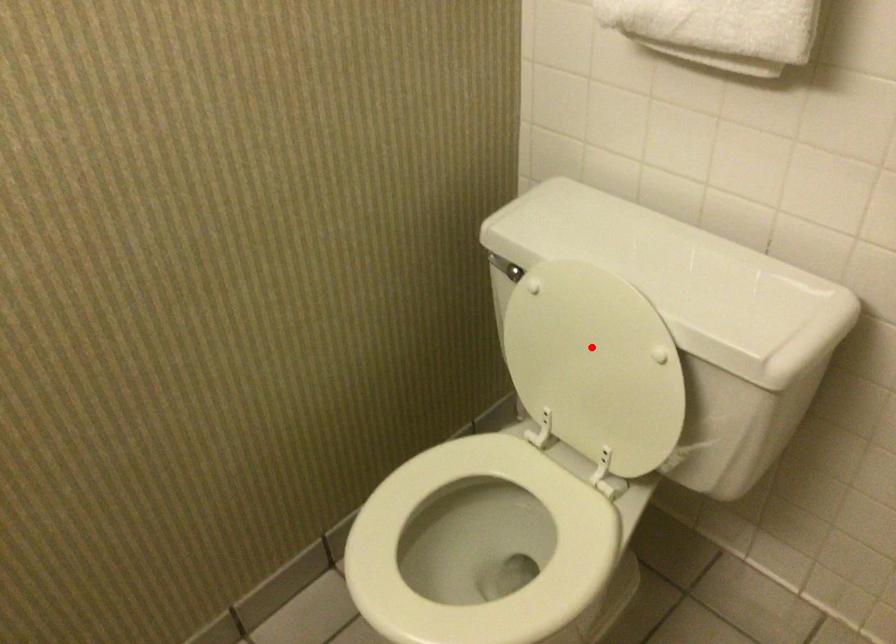
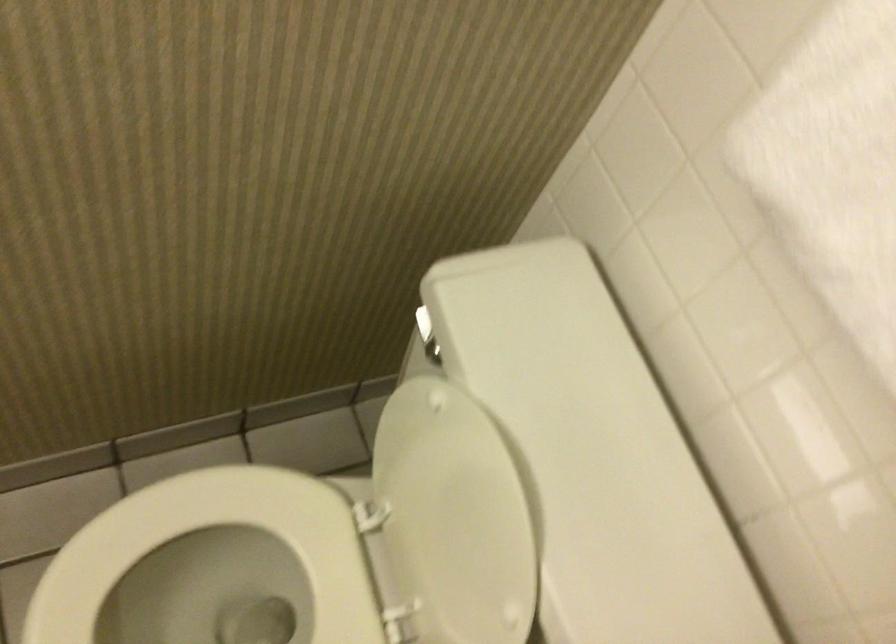
Locate, in the second image, the point that corresponds to the highlighted location in the first image.

(453, 518)